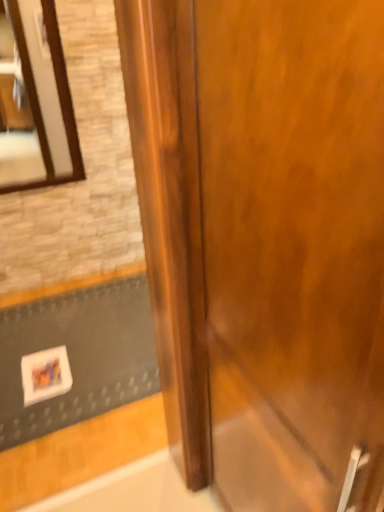
In order to click on white matte doormat at lower left in this screenshot , I will do `click(78, 356)`.

Measure the distance between wooden-framed mirror at upper left and camera.

The distance of wooden-framed mirror at upper left from camera is 6.50 feet.

From the picture: In order to face wooden-framed mirror at upper left, should I rotate leftwards or rightwards?

You should rotate left by 21.489 degrees.

Image resolution: width=384 pixels, height=512 pixels. What do you see at coordinates (264, 240) in the screenshot?
I see `glossy wood door at center` at bounding box center [264, 240].

This screenshot has width=384, height=512. I want to click on white matte doormat at lower left, so click(78, 356).

Find the location of `doormat below the glossy wood door at center (from the image's perspective)`. doormat below the glossy wood door at center (from the image's perspective) is located at coordinates (78, 356).

Is glossy wood door at center aimed at white matte doormat at lower left?

No, glossy wood door at center is not facing towards white matte doormat at lower left.

Is glossy wood door at center located outside white matte doormat at lower left?

Absolutely, glossy wood door at center is external to white matte doormat at lower left.

Is white matte doormat at lower left spatially inside glossy wood door at center, or outside of it?

white matte doormat at lower left is not enclosed by glossy wood door at center.

How far apart are white matte doormat at lower left and glossy wood door at center?

white matte doormat at lower left and glossy wood door at center are 3.96 feet apart from each other.

Is glossy wood door at center at the back of white matte doormat at lower left?

white matte doormat at lower left does not have its back to glossy wood door at center.

Which object is wider, white matte doormat at lower left or glossy wood door at center?

white matte doormat at lower left.

Between white matte doormat at lower left and wooden-framed mirror at upper left, which one has more height?

With more height is wooden-framed mirror at upper left.

Would you say white matte doormat at lower left is to the left or to the right of wooden-framed mirror at upper left in the picture?

Clearly, white matte doormat at lower left is on the right of wooden-framed mirror at upper left in the image.

Is white matte doormat at lower left not near wooden-framed mirror at upper left?

No, white matte doormat at lower left is not far from wooden-framed mirror at upper left.

Which of these two, white matte doormat at lower left or wooden-framed mirror at upper left, is bigger?

With larger size is white matte doormat at lower left.

Is glossy wood door at center facing away from wooden-framed mirror at upper left?

That's not correct — glossy wood door at center is not looking away from wooden-framed mirror at upper left.

Can you tell me how much glossy wood door at center and wooden-framed mirror at upper left differ in facing direction?

The facing directions of glossy wood door at center and wooden-framed mirror at upper left are 88.1 degrees apart.

From a real-world perspective, which object stands above the other?

wooden-framed mirror at upper left, from a real-world perspective.

Which object is positioned more to the right, glossy wood door at center or wooden-framed mirror at upper left?

glossy wood door at center.

Would you say white matte doormat at lower left is part of wooden-framed mirror at upper left's contents?

No, white matte doormat at lower left is not inside wooden-framed mirror at upper left.

Between wooden-framed mirror at upper left and white matte doormat at lower left, which one has smaller size?

Smaller between the two is wooden-framed mirror at upper left.

Does wooden-framed mirror at upper left appear on the right side of white matte doormat at lower left?

No, wooden-framed mirror at upper left is not to the right of white matte doormat at lower left.

From a real-world perspective, is wooden-framed mirror at upper left positioned over white matte doormat at lower left based on gravity?

Correct, in the physical world, wooden-framed mirror at upper left is higher than white matte doormat at lower left.

How many degrees apart are the facing directions of wooden-framed mirror at upper left and glossy wood door at center?

The facing directions of wooden-framed mirror at upper left and glossy wood door at center are 88.1 degrees apart.

From a real-world perspective, is wooden-framed mirror at upper left positioned above or below glossy wood door at center?

In terms of real-world spatial position, wooden-framed mirror at upper left is above glossy wood door at center.

Locate an element on the screen. The width and height of the screenshot is (384, 512). door below the wooden-framed mirror at upper left (from the image's perspective) is located at coordinates (264, 240).

Is wooden-framed mirror at upper left turned away from glossy wood door at center?

No, glossy wood door at center is not at the back of wooden-framed mirror at upper left.

Where is `doormat below the glossy wood door at center (from the image's perspective)`? doormat below the glossy wood door at center (from the image's perspective) is located at coordinates (78, 356).

At what (x,y) coordinates should I click in order to perform the action: click on door above the white matte doormat at lower left (from the image's perspective). Please return your answer as a coordinate pair (x, y). Looking at the image, I should click on (264, 240).

From the image, which object appears to be nearer to wooden-framed mirror at upper left, white matte doormat at lower left or glossy wood door at center?

Among the two, white matte doormat at lower left is located nearer to wooden-framed mirror at upper left.

Estimate the real-world distances between objects in this image. Which object is further from wooden-framed mirror at upper left, glossy wood door at center or white matte doormat at lower left?

glossy wood door at center is positioned further to the anchor wooden-framed mirror at upper left.

Looking at the image, which one is located further to glossy wood door at center, white matte doormat at lower left or wooden-framed mirror at upper left?

wooden-framed mirror at upper left lies further to glossy wood door at center than the other object.

Looking at the image, which one is located further to white matte doormat at lower left, wooden-framed mirror at upper left or glossy wood door at center?

glossy wood door at center lies further to white matte doormat at lower left than the other object.

Looking at the image, which one is located closer to white matte doormat at lower left, glossy wood door at center or wooden-framed mirror at upper left?

Based on the image, wooden-framed mirror at upper left appears to be nearer to white matte doormat at lower left.

Based on the photo, looking at the image, which one is located further to glossy wood door at center, wooden-framed mirror at upper left or white matte doormat at lower left?

Among the two, wooden-framed mirror at upper left is located further to glossy wood door at center.

Identify the location of doormat between glossy wood door at center and wooden-framed mirror at upper left in the front-back direction. (78, 356).